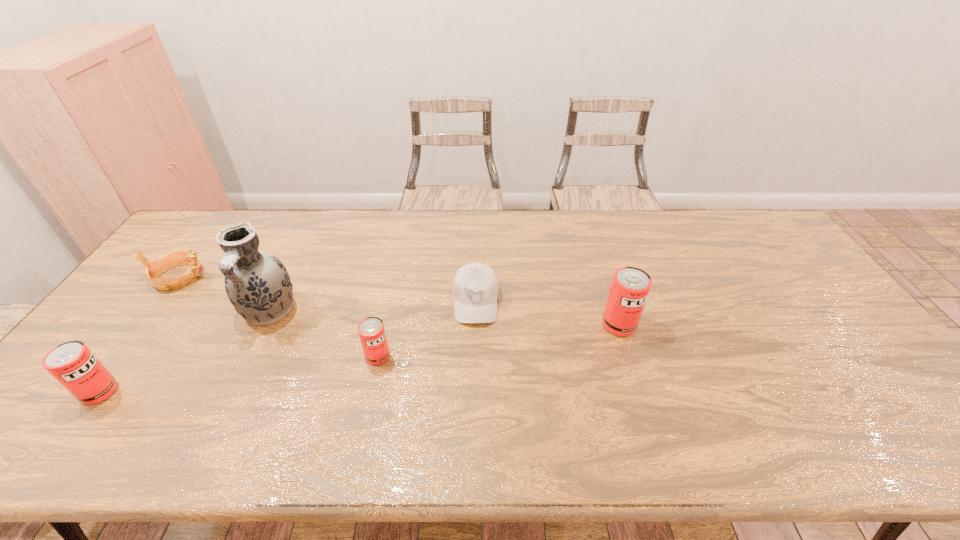
Where is `vacant region located 0.250m on the back of the nearest can`? vacant region located 0.250m on the back of the nearest can is located at coordinates (163, 306).

You are a GUI agent. You are given a task and a screenshot of the screen. Output one action in this format:
    pyautogui.click(x=<x>, y=<y>)
    Task: Click on the free space located 0.120m on the back of the second nearest object
    
    Given the screenshot: What is the action you would take?
    pyautogui.click(x=387, y=313)

You are a GUI agent. You are given a task and a screenshot of the screen. Output one action in this format:
    pyautogui.click(x=<x>, y=<y>)
    Task: Click on the vacant space positioned on the left of the rightmost object
    The height and width of the screenshot is (540, 960).
    Given the screenshot: What is the action you would take?
    pyautogui.click(x=573, y=325)

The image size is (960, 540). What are the coordinates of `free space located 0.140m with the handle on the side of the fourth object from right to left` in the screenshot? It's located at (236, 379).

Locate an element on the screen. This screenshot has width=960, height=540. free space located 0.230m on the front-facing side of the fifth object from left to right is located at coordinates (474, 400).

Identify the location of vacant region located at the front emblem of the tiara. This screenshot has height=540, width=960. (237, 276).

The width and height of the screenshot is (960, 540). Identify the location of object located in the near edge section of the desktop. (72, 364).

You are a GUI agent. You are given a task and a screenshot of the screen. Output one action in this format:
    pyautogui.click(x=<x>, y=<y>)
    Task: Click on the can present at the left edge
    Image resolution: width=960 pixels, height=540 pixels.
    Given the screenshot: What is the action you would take?
    pyautogui.click(x=72, y=364)

The image size is (960, 540). In order to click on tiara situated at the left edge in this screenshot , I will do `click(178, 256)`.

Locate an element on the screen. Image resolution: width=960 pixels, height=540 pixels. object located at the near left corner is located at coordinates (72, 364).